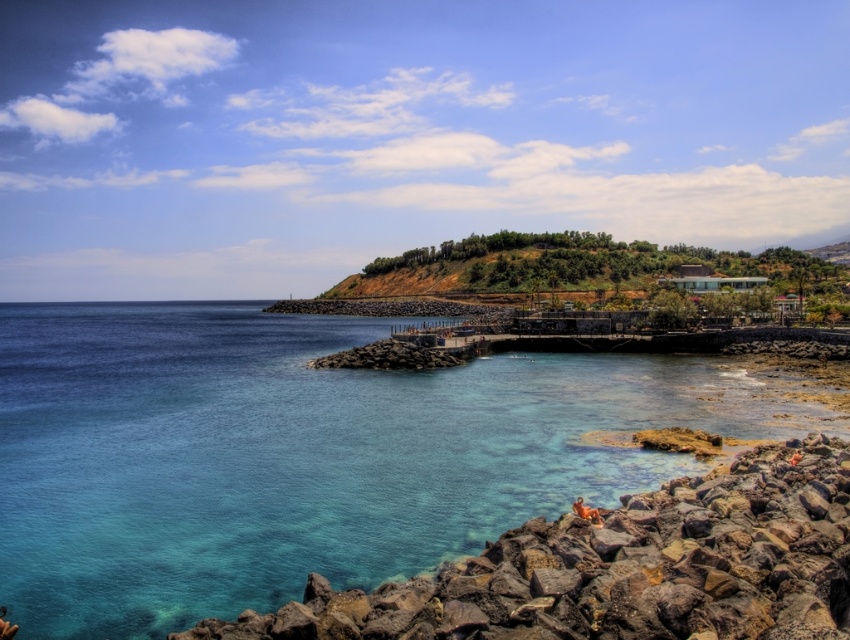
Is rockyrough stonerocks at lower right further to the viewer compared to green grassy hill at upper center?

No, it is in front of green grassy hill at upper center.

The image size is (850, 640). What do you see at coordinates (624, 568) in the screenshot?
I see `rockyrough stonerocks at lower right` at bounding box center [624, 568].

Identify the location of rockyrough stonerocks at lower right. (624, 568).

Which is below, clear blue water at center or rockyrough stonerocks at lower right?

rockyrough stonerocks at lower right

Can you confirm if clear blue water at center is positioned to the left of rockyrough stonerocks at lower right?

Correct, you'll find clear blue water at center to the left of rockyrough stonerocks at lower right.

Find the location of `clear blue water at center`. clear blue water at center is located at coordinates (272, 456).

Is point (354, 422) positioned behind point (456, 252)?

No, it is in front of (456, 252).

Can you confirm if clear blue water at center is bigger than green grassy hill at upper center?

No, clear blue water at center is not bigger than green grassy hill at upper center.

Is point (282, 451) more distant than point (791, 253)?

No, (282, 451) is in front of (791, 253).

Locate an element on the screen. This screenshot has height=640, width=850. clear blue water at center is located at coordinates (272, 456).